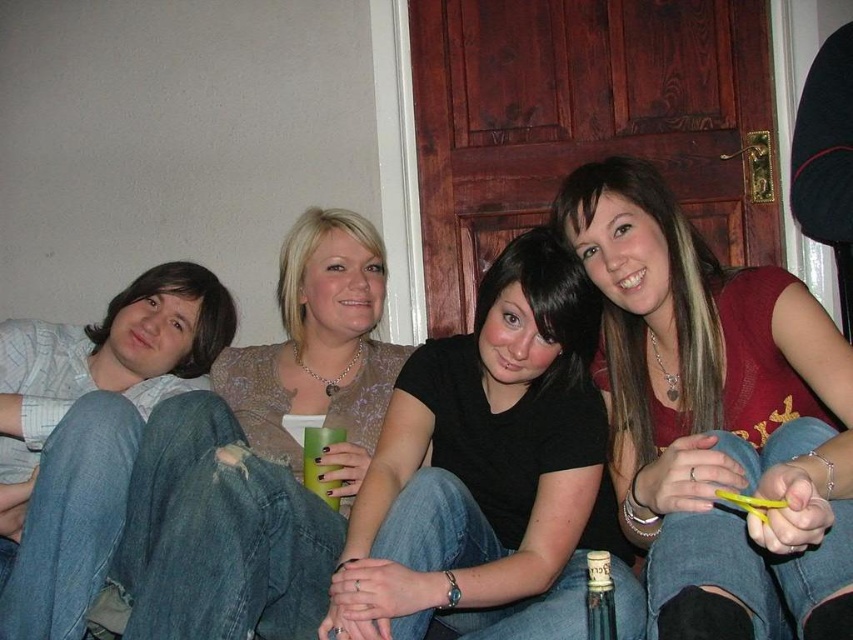
Question: Which object is positioned farthest from the matte red sweater at center?

Choices:
 (A) green matte cup at center
 (B) matte beige sweater at upper center
 (C) translucent glass bottle at lower center
 (D) black matte shirt at center

Answer: (A)

Question: Considering the real-world distances, which object is closest to the black matte shirt at center?

Choices:
 (A) matte red sweater at center
 (B) translucent glass bottle at lower center
 (C) green matte cup at center

Answer: (A)

Question: Is the position of matte beige sweater at upper center more distant than that of green matte cup at center?

Choices:
 (A) yes
 (B) no

Answer: (B)

Question: Which object is farther from the camera taking this photo?

Choices:
 (A) black matte shirt at center
 (B) green matte cup at center
 (C) matte red sweater at center

Answer: (B)

Question: In this image, where is matte red sweater at center located relative to matte beige sweater at upper center?

Choices:
 (A) right
 (B) left

Answer: (A)

Question: From the image, what is the correct spatial relationship of matte beige sweater at upper center in relation to green matte cup at center?

Choices:
 (A) right
 (B) left

Answer: (B)